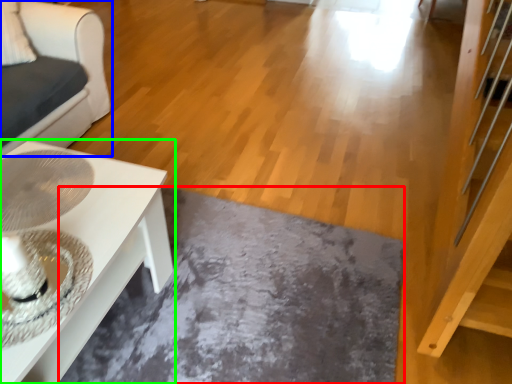
Question: Estimate the real-world distances between objects in this image. Which object is farther from slate (highlighted by a red box), furniture (highlighted by a blue box) or table (highlighted by a green box)?

Choices:
 (A) furniture
 (B) table

Answer: (A)